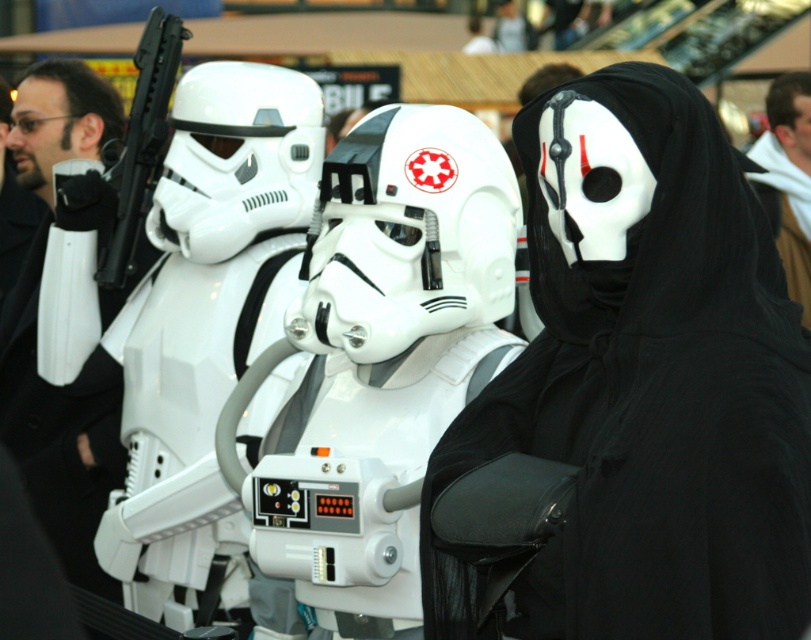
In the scene shown: Does black matte mask at center have a smaller size compared to matte black coat at left?

Incorrect, black matte mask at center is not smaller in size than matte black coat at left.

Between point (486, 448) and point (31, 497), which one is positioned behind?

Point (31, 497)

Where is `black matte mask at center`? black matte mask at center is located at coordinates (634, 394).

Is black matte mask at center above black fabric scarf at upper right?

Actually, black matte mask at center is below black fabric scarf at upper right.

Which is more to the left, black matte mask at center or black fabric scarf at upper right?

Positioned to the left is black matte mask at center.

Where is `black matte mask at center`? black matte mask at center is located at coordinates (634, 394).

Which is more to the right, matte black coat at left or black fabric scarf at upper right?

From the viewer's perspective, black fabric scarf at upper right appears more on the right side.

Who is higher up, matte black coat at left or black fabric scarf at upper right?

Positioned higher is black fabric scarf at upper right.

I want to click on matte black coat at left, so click(x=59, y=429).